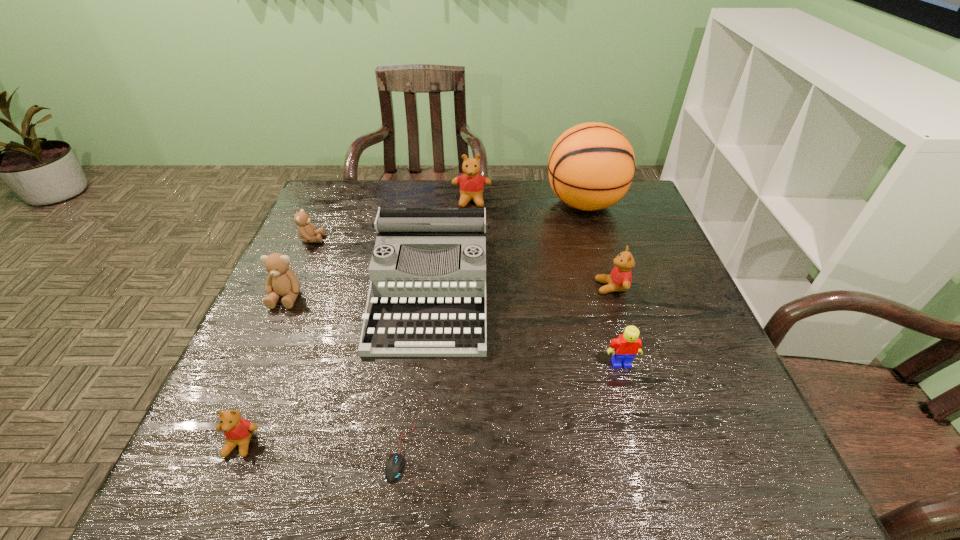
I want to click on vacant position at the far right corner of the desktop, so click(619, 215).

Where is `free region at the near right corner`? The width and height of the screenshot is (960, 540). free region at the near right corner is located at coordinates (724, 481).

Image resolution: width=960 pixels, height=540 pixels. What are the coordinates of `vacant area between the tallest object and the yellow Lego` in the screenshot? It's located at (603, 284).

The height and width of the screenshot is (540, 960). I want to click on free space between the shortest object and the second farthest teddy bear, so click(356, 345).

The width and height of the screenshot is (960, 540). Find the location of `free space between the seventh farthest object and the nearest red teddy bear`. free space between the seventh farthest object and the nearest red teddy bear is located at coordinates (431, 403).

Identify the location of empty location between the basketball and the second biggest red teddy bear. This screenshot has width=960, height=540. (598, 245).

Identify the location of the second closest object to the smaller brown teddy bear. This screenshot has height=540, width=960. [x=427, y=296].

Locate an element on the screen. This screenshot has height=540, width=960. the third closest object to the typewriter is located at coordinates (281, 281).

Locate which teddy bear is the third closest to the leftmost red teddy bear. Please provide its 2D coordinates. Your answer should be formatted as a tuple, i.e. [(x, y)], where the tuple contains the x and y coordinates of a point satisfying the conditions above.

[(620, 278)]

Identify the location of teddy bear that is the third nearest to the basketball. (306, 230).